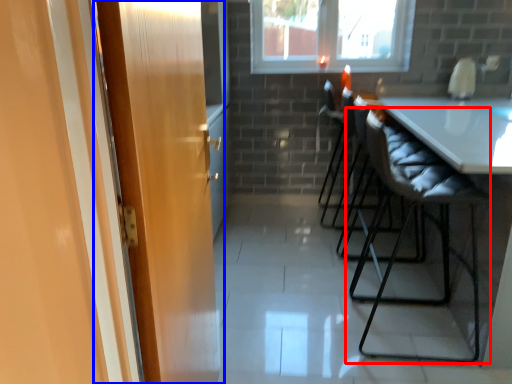
Question: Which of the following is the closest to the observer, chair (highlighted by a red box) or door (highlighted by a blue box)?

Choices:
 (A) chair
 (B) door

Answer: (B)